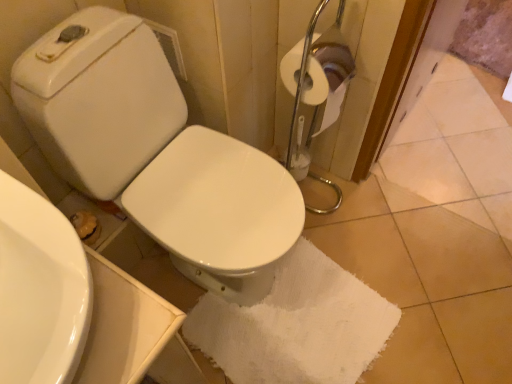
Question: Is white cotton bath towel at center in contact with white glossy sink at lower left?

Choices:
 (A) no
 (B) yes

Answer: (A)

Question: Is white cotton bath towel at center looking in the opposite direction of white glossy sink at lower left?

Choices:
 (A) no
 (B) yes

Answer: (A)

Question: Considering the relative positions of white cotton bath towel at center and white glossy sink at lower left in the image provided, is white cotton bath towel at center behind white glossy sink at lower left?

Choices:
 (A) yes
 (B) no

Answer: (A)

Question: Does white cotton bath towel at center have a lesser height compared to white glossy sink at lower left?

Choices:
 (A) yes
 (B) no

Answer: (A)

Question: Can you confirm if white cotton bath towel at center is taller than white glossy sink at lower left?

Choices:
 (A) yes
 (B) no

Answer: (B)

Question: From the image's perspective, is white glossy sink at lower left positioned above or below white glossy toilet at center?

Choices:
 (A) above
 (B) below

Answer: (B)

Question: Considering their positions, is white glossy sink at lower left located in front of or behind white glossy toilet at center?

Choices:
 (A) behind
 (B) front

Answer: (B)

Question: Considering the positions of white glossy sink at lower left and white glossy toilet at center in the image, is white glossy sink at lower left bigger or smaller than white glossy toilet at center?

Choices:
 (A) small
 (B) big

Answer: (A)

Question: Considering the positions of point (2, 172) and point (160, 190), is point (2, 172) closer or farther from the camera than point (160, 190)?

Choices:
 (A) closer
 (B) farther

Answer: (A)

Question: Is point (130, 54) closer or farther from the camera than point (224, 336)?

Choices:
 (A) closer
 (B) farther

Answer: (A)

Question: Looking at their shapes, would you say white glossy toilet at center is wider or thinner than white cotton bath towel at center?

Choices:
 (A) wide
 (B) thin

Answer: (A)

Question: Considering the positions of white glossy toilet at center and white cotton bath towel at center in the image, is white glossy toilet at center taller or shorter than white cotton bath towel at center?

Choices:
 (A) short
 (B) tall

Answer: (B)

Question: Is white glossy toilet at center bigger or smaller than white cotton bath towel at center?

Choices:
 (A) small
 (B) big

Answer: (B)

Question: From a real-world perspective, is white glossy toilet at center physically located above or below white glossy sink at lower left?

Choices:
 (A) above
 (B) below

Answer: (B)

Question: Is white glossy toilet at center to the left or to the right of white glossy sink at lower left in the image?

Choices:
 (A) right
 (B) left

Answer: (A)